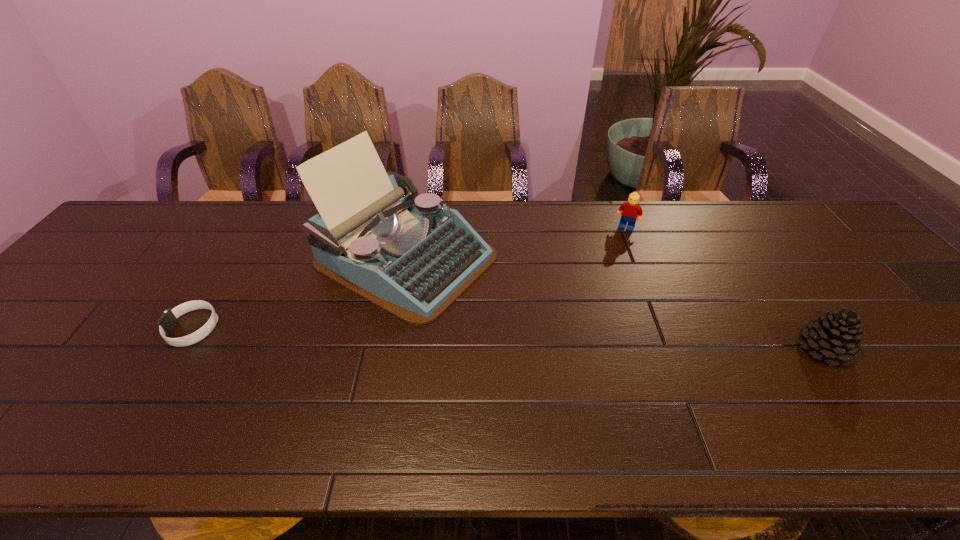
The width and height of the screenshot is (960, 540). In order to click on free space located at the narrow end of the pinecone in this screenshot , I will do `click(665, 349)`.

Locate an element on the screen. blank area located at the narrow end of the pinecone is located at coordinates (648, 349).

Locate an element on the screen. vacant space located 0.080m on the typing side of the second object from left to right is located at coordinates pos(507,306).

Locate an element on the screen. This screenshot has width=960, height=540. free region located on the typing side of the second object from left to right is located at coordinates (527, 316).

The image size is (960, 540). Find the location of `free location located on the typing side of the second object from left to right`. free location located on the typing side of the second object from left to right is located at coordinates (544, 325).

Locate an element on the screen. free space located on the front-facing side of the Lego is located at coordinates (605, 269).

The height and width of the screenshot is (540, 960). What are the coordinates of `vacant space located 0.260m on the front-facing side of the Lego` in the screenshot? It's located at (598, 285).

Locate an element on the screen. vacant space situated 0.180m on the front-facing side of the Lego is located at coordinates (606, 267).

This screenshot has height=540, width=960. What are the coordinates of `typewriter present at the far edge` in the screenshot? It's located at (374, 235).

The height and width of the screenshot is (540, 960). Identify the location of Lego that is positioned at the far edge. (631, 211).